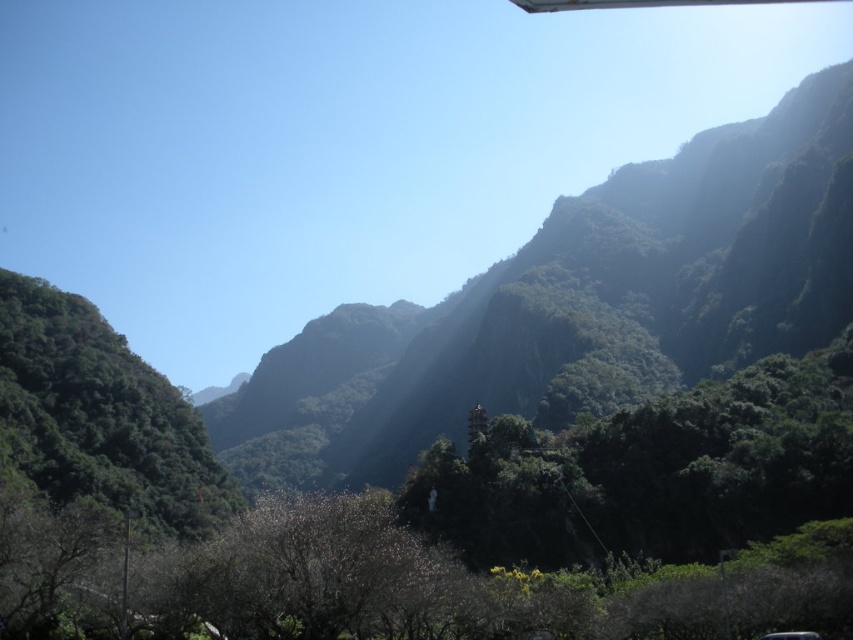
You are planning to plant a new tree in your backyard. You have two options from the image provided. Which tree, the green matte tree at center or the green leafy tree at left, would require less space due to its size?

The green matte tree at center has a smaller size compared to the green leafy tree at left, so it would require less space.

You are a hiker standing at the base of the mountain and looking up. You see the green matte tree at center and the green leafy tree at left. Which tree is closer to you?

The green leafy tree at left is closer to you because the green matte tree at center is positioned over it, indicating it is further away.

You are standing in the mountain landscape and want to walk towards the temple. You notice the green matte tree at center and the green leafy tree at left. Which tree is closer to you as you head towards the temple?

The green matte tree at center is closer to you because it is further to the viewer than the green leafy tree at left, meaning it is positioned nearer in the scene.